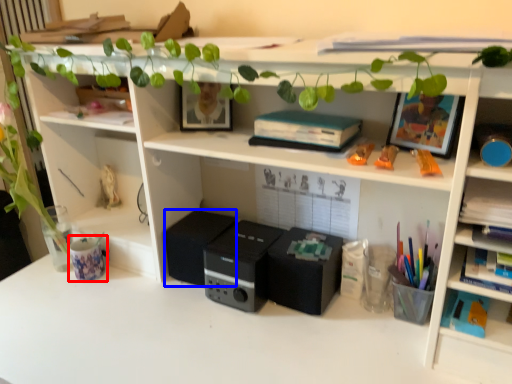
Question: Which object appears closest to the camera in this image, stationery (highlighted by a red box) or speaker (highlighted by a blue box)?

Choices:
 (A) stationery
 (B) speaker

Answer: (B)